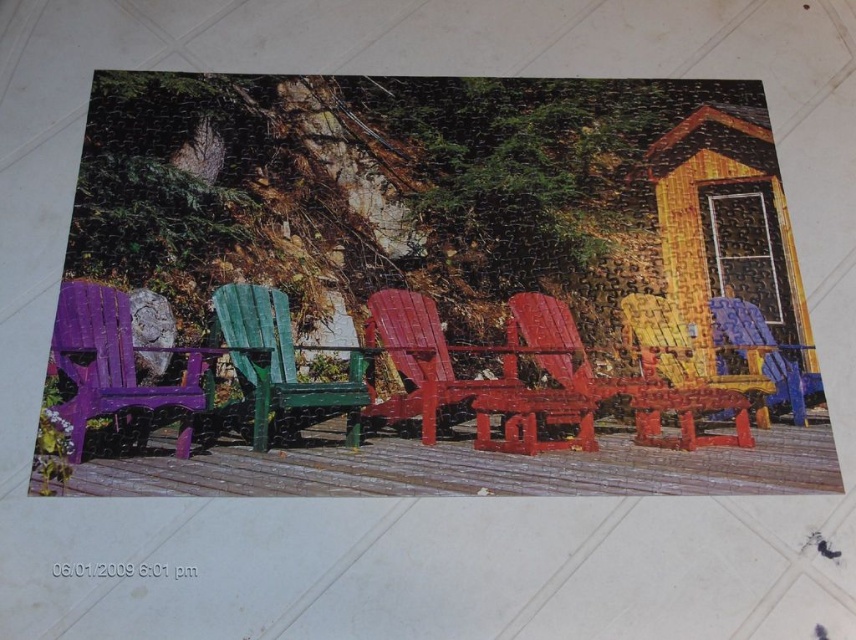
You are trying to fit a new chair into the row of chairs in the puzzle. The glossy wood chair at center and the blue glossy chair at center are already placed. Which chair has a larger width to accommodate more seating space?

The glossy wood chair at center has a larger width than the blue glossy chair at center, so it can accommodate more seating space.

You are arranging chairs for a small gathering. You have a purple matte plastic chair at left and a green matte wood chair at center. According to the puzzle layout, which chair is positioned to the right of the other?

The purple matte plastic chair at left is to the right of the green matte wood chair at center.

You are trying to assemble the jigsaw puzzle and need to place the glossy wood chair at center and the blue glossy chair at center correctly. According to the puzzle image, which chair is positioned lower in the scene?

The glossy wood chair at center is located below the blue glossy chair at center, so it is positioned lower in the scene.